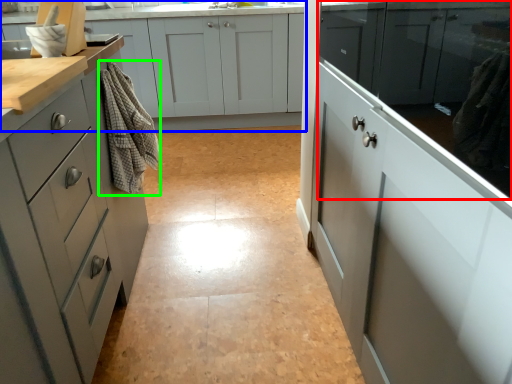
Question: Which object is the closest to the cabinetry (highlighted by a red box)? Choose among these: cabinetry (highlighted by a blue box) or material (highlighted by a green box).

Choices:
 (A) cabinetry
 (B) material

Answer: (B)